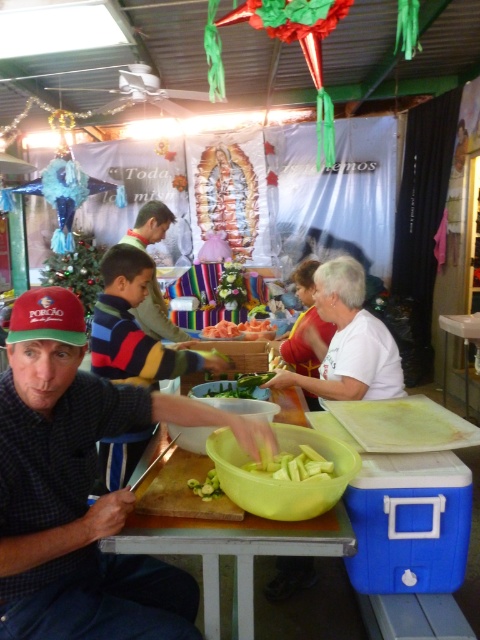
What is the exact coordinate of the orange fleshed fruit at center?

The orange fleshed fruit at center is located at point (241,330).

You are standing in the market scene and want to greet the person wearing the striped sweater at center. Which direction should you move to face them from the white matte shirt at center?

Since the white matte shirt at center is to the right of the striped sweater at center, you should move to the left to face the striped sweater at center from the white matte shirt at center.

You are a photographer at the market and need to decide which clothing item to focus on for a closeup shot. Since the white matte shirt at center and striped sweater at center are both in the center, which one would you choose if you want to capture more details of the clothing?

The white matte shirt at center has a larger size compared to striped sweater at center, so choosing the white matte shirt at center would allow capturing more details due to its bigger size.